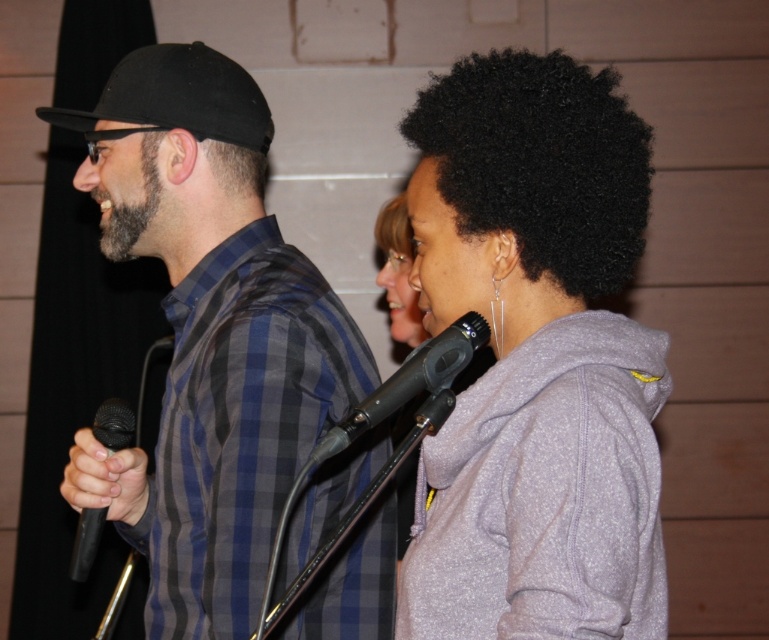
Question: Can you confirm if gray fleece hoodie at center is wider than black matte microphone at center?

Choices:
 (A) no
 (B) yes

Answer: (B)

Question: Which point is closer to the camera?

Choices:
 (A) (468, 563)
 (B) (473, 330)
 (C) (218, 477)
 (D) (87, 524)

Answer: (A)

Question: Which point appears closest to the camera in this image?

Choices:
 (A) (235, 508)
 (B) (185, 120)

Answer: (A)

Question: Which point is farther to the camera?

Choices:
 (A) black matte baseball cap at left
 (B) black matte microphone at left

Answer: (A)

Question: Does plaid shirt at left have a greater width compared to black matte microphone at center?

Choices:
 (A) no
 (B) yes

Answer: (B)

Question: Can you confirm if gray fleece hoodie at center is positioned to the right of black matte baseball cap at left?

Choices:
 (A) no
 (B) yes

Answer: (B)